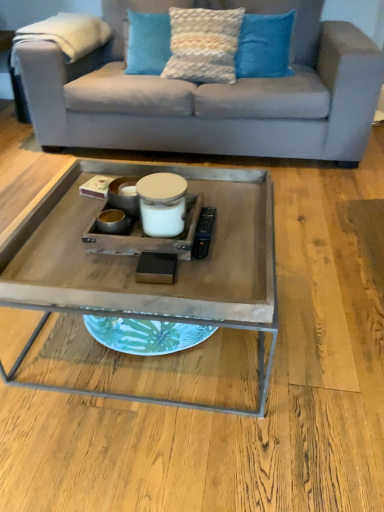
Measure the distance between textured blue pillow at upper center, acting as the first pillow starting from the left, and camera.

8.67 feet.

Where is `blue textured pillow at upper center, which ranks as the third pillow in left-to-right order`? The image size is (384, 512). blue textured pillow at upper center, which ranks as the third pillow in left-to-right order is located at coordinates (264, 46).

At what (x,y) coordinates should I click in order to perform the action: click on textured blue pillow at upper center, acting as the first pillow starting from the left. Please return your answer as a coordinate pair (x, y). Image resolution: width=384 pixels, height=512 pixels. Looking at the image, I should click on (147, 42).

Measure the distance from textured cream pillow at upper center, which is the second pillow from right to left, to wooden tray at center.

The distance of textured cream pillow at upper center, which is the second pillow from right to left, from wooden tray at center is 4.67 feet.

From the wooden tray at center, count 1st pillows backward and point to it. Please provide its 2D coordinates.

[(203, 44)]

Is wooden tray at center at the back of textured cream pillow at upper center, which is the second pillow from right to left?

textured cream pillow at upper center, which is the second pillow from right to left, is not turned away from wooden tray at center.

Does textured cream pillow at upper center, acting as the second pillow starting from the left, have a lesser height compared to wooden tray at center?

Correct, textured cream pillow at upper center, acting as the second pillow starting from the left, is not as tall as wooden tray at center.

From a real-world perspective, is blue textured pillow at upper center, which ranks as the third pillow in left-to-right order, positioned over textured blue pillow at upper center, acting as the first pillow starting from the left, based on gravity?

Yes, from a real-world perspective, blue textured pillow at upper center, which ranks as the third pillow in left-to-right order, is on top of textured blue pillow at upper center, acting as the first pillow starting from the left.

What's the angular difference between blue textured pillow at upper center, which ranks as the third pillow in left-to-right order, and textured blue pillow at upper center, the third pillow from the right,'s facing directions?

The angle between the facing direction of blue textured pillow at upper center, which ranks as the third pillow in left-to-right order, and the facing direction of textured blue pillow at upper center, the third pillow from the right, is 0.00235 degrees.

Between blue textured pillow at upper center, which ranks as the third pillow in left-to-right order, and textured blue pillow at upper center, the third pillow from the right, which one has less height?

textured blue pillow at upper center, the third pillow from the right, is shorter.

Is light gray fabric couch at upper center surrounding wooden tray at center?

Actually, wooden tray at center is outside light gray fabric couch at upper center.

From the image's perspective, is light gray fabric couch at upper center beneath wooden tray at center?

No, from the image's perspective, light gray fabric couch at upper center is not beneath wooden tray at center.

Measure the distance from light gray fabric couch at upper center to wooden tray at center.

light gray fabric couch at upper center is 4.18 feet away from wooden tray at center.

From a real-world perspective, is light gray fabric couch at upper center positioned above or below wooden tray at center?

light gray fabric couch at upper center is above wooden tray at center.

From a real-world perspective, is light gray fabric couch at upper center positioned over textured blue pillow at upper center, the third pillow from the right, based on gravity?

Actually, light gray fabric couch at upper center is physically below textured blue pillow at upper center, the third pillow from the right, in the real world.

Could you measure the distance between light gray fabric couch at upper center and textured blue pillow at upper center, acting as the first pillow starting from the left?

They are 19.00 inches apart.

Is light gray fabric couch at upper center aimed at textured blue pillow at upper center, the third pillow from the right?

Yes, light gray fabric couch at upper center is facing textured blue pillow at upper center, the third pillow from the right.

Do you think light gray fabric couch at upper center is within textured blue pillow at upper center, the third pillow from the right, or outside of it?

light gray fabric couch at upper center is not enclosed by textured blue pillow at upper center, the third pillow from the right.

Consider the image. From a real-world perspective, is light gray fabric couch at upper center positioned above or below textured cream pillow at upper center, which is the second pillow from right to left?

In terms of real-world spatial position, light gray fabric couch at upper center is below textured cream pillow at upper center, which is the second pillow from right to left.

Visually, is light gray fabric couch at upper center positioned to the left or to the right of textured cream pillow at upper center, acting as the second pillow starting from the left?

light gray fabric couch at upper center is to the right of textured cream pillow at upper center, acting as the second pillow starting from the left.

Identify the location of studio couch that is below the textured cream pillow at upper center, acting as the second pillow starting from the left (from the image's perspective). (215, 95).

Between textured blue pillow at upper center, the third pillow from the right, and light gray fabric couch at upper center, which one has more height?

light gray fabric couch at upper center.

Which object is further away from the camera, textured blue pillow at upper center, acting as the first pillow starting from the left, or light gray fabric couch at upper center?

textured blue pillow at upper center, acting as the first pillow starting from the left, is further from the camera.

Based on their sizes in the image, would you say textured blue pillow at upper center, the third pillow from the right, is bigger or smaller than light gray fabric couch at upper center?

textured blue pillow at upper center, the third pillow from the right, is smaller than light gray fabric couch at upper center.

From the picture: Can you confirm if textured blue pillow at upper center, acting as the first pillow starting from the left, is wider than light gray fabric couch at upper center?

In fact, textured blue pillow at upper center, acting as the first pillow starting from the left, might be narrower than light gray fabric couch at upper center.

Consider the image. From a real-world perspective, is wooden tray at center beneath textured cream pillow at upper center, acting as the second pillow starting from the left?

Yes, from a real-world perspective, wooden tray at center is beneath textured cream pillow at upper center, acting as the second pillow starting from the left.

Could you tell me if wooden tray at center is facing textured cream pillow at upper center, which is the second pillow from right to left?

No, wooden tray at center is not aimed at textured cream pillow at upper center, which is the second pillow from right to left.

Measure the distance between wooden tray at center and textured cream pillow at upper center, which is the second pillow from right to left.

1.42 meters.

From the image's perspective, would you say wooden tray at center is shown under textured cream pillow at upper center, which is the second pillow from right to left?

Indeed, from the image's perspective, wooden tray at center is shown beneath textured cream pillow at upper center, which is the second pillow from right to left.

From a real-world perspective, which pillow is the 3rd one above the wooden tray at center? Please provide its 2D coordinates.

[(203, 44)]

At what (x,y) coordinates should I click in order to perform the action: click on the 2nd pillow to the left when counting from the blue textured pillow at upper center, marked as the first pillow in a right-to-left arrangement. Please return your answer as a coordinate pair (x, y). Looking at the image, I should click on (147, 42).

Which object lies further to the anchor point light gray fabric couch at upper center, blue textured pillow at upper center, which ranks as the third pillow in left-to-right order, or textured cream pillow at upper center, acting as the second pillow starting from the left?

blue textured pillow at upper center, which ranks as the third pillow in left-to-right order, lies further to light gray fabric couch at upper center than the other object.

Looking at this image, when comparing their distances from textured blue pillow at upper center, acting as the first pillow starting from the left, does blue textured pillow at upper center, which ranks as the third pillow in left-to-right order, or wooden tray at center seem closer?

The object closer to textured blue pillow at upper center, acting as the first pillow starting from the left, is blue textured pillow at upper center, which ranks as the third pillow in left-to-right order.

Based on their spatial positions, is light gray fabric couch at upper center or textured cream pillow at upper center, which is the second pillow from right to left, further from blue textured pillow at upper center, which ranks as the third pillow in left-to-right order?

Among the two, light gray fabric couch at upper center is located further to blue textured pillow at upper center, which ranks as the third pillow in left-to-right order.

Based on their spatial positions, is blue textured pillow at upper center, marked as the first pillow in a right-to-left arrangement, or textured cream pillow at upper center, which is the second pillow from right to left, closer to wooden tray at center?

textured cream pillow at upper center, which is the second pillow from right to left, lies closer to wooden tray at center than the other object.

Estimate the real-world distances between objects in this image. Which object is closer to blue textured pillow at upper center, marked as the first pillow in a right-to-left arrangement, wooden tray at center or light gray fabric couch at upper center?

light gray fabric couch at upper center is positioned closer to the anchor blue textured pillow at upper center, marked as the first pillow in a right-to-left arrangement.

When comparing their distances from light gray fabric couch at upper center, does blue textured pillow at upper center, which ranks as the third pillow in left-to-right order, or wooden tray at center seem closer?

blue textured pillow at upper center, which ranks as the third pillow in left-to-right order, is closer to light gray fabric couch at upper center.

Considering their positions, is light gray fabric couch at upper center positioned further to textured cream pillow at upper center, acting as the second pillow starting from the left, than blue textured pillow at upper center, marked as the first pillow in a right-to-left arrangement?

Among the two, light gray fabric couch at upper center is located further to textured cream pillow at upper center, acting as the second pillow starting from the left.

When comparing their distances from blue textured pillow at upper center, which ranks as the third pillow in left-to-right order, does textured blue pillow at upper center, acting as the first pillow starting from the left, or wooden tray at center seem further?

wooden tray at center.

You are a GUI agent. You are given a task and a screenshot of the screen. Output one action in this format:
    pyautogui.click(x=<x>, y=<y>)
    Task: Click on the pillow located between light gray fabric couch at upper center and blue textured pillow at upper center, marked as the first pillow in a right-to-left arrangement, in the depth direction
    
    Given the screenshot: What is the action you would take?
    pyautogui.click(x=203, y=44)

Locate an element on the screen. This screenshot has width=384, height=512. studio couch between textured blue pillow at upper center, acting as the first pillow starting from the left, and wooden tray at center vertically is located at coordinates (215, 95).

The height and width of the screenshot is (512, 384). What are the coordinates of `studio couch between textured blue pillow at upper center, acting as the first pillow starting from the left, and blue textured pillow at upper center, marked as the first pillow in a right-to-left arrangement, from left to right` in the screenshot? It's located at (215, 95).

Where is `studio couch between blue textured pillow at upper center, which ranks as the third pillow in left-to-right order, and wooden tray at center, in the vertical direction`? This screenshot has width=384, height=512. studio couch between blue textured pillow at upper center, which ranks as the third pillow in left-to-right order, and wooden tray at center, in the vertical direction is located at coordinates (215, 95).